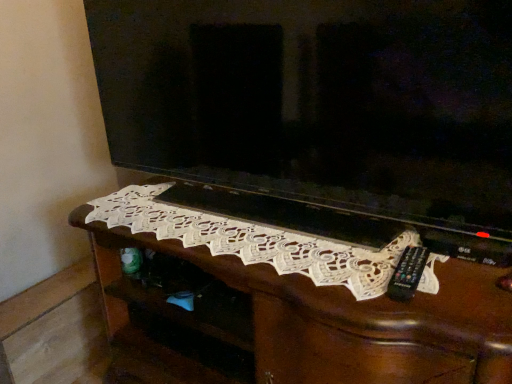
The width and height of the screenshot is (512, 384). Identify the location of empty space that is ontop of white lace doily at center (from a real-world perspective). pyautogui.click(x=274, y=231).